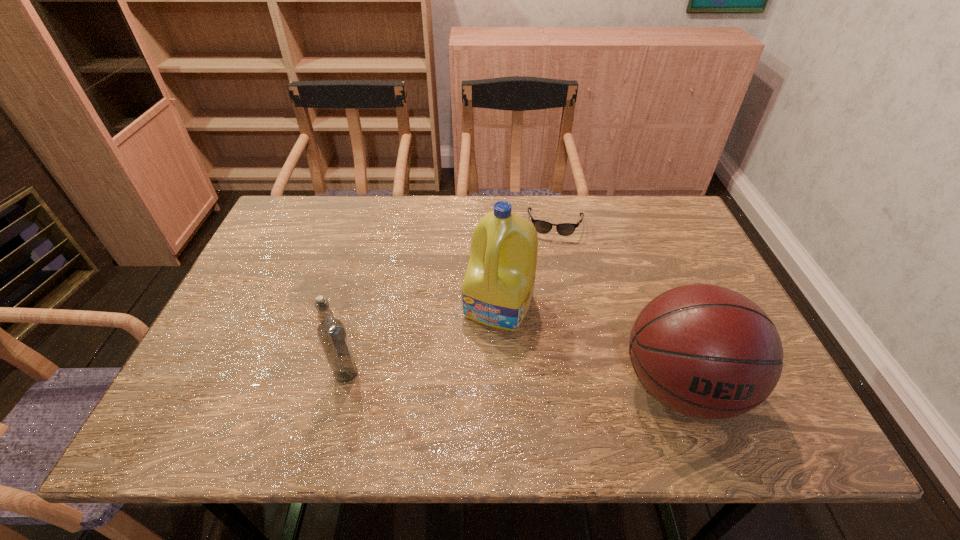
Where is `vacant space on the desktop that is between the leftmost object and the basketball and is positioned on the front-facing side of the farthest object`? Image resolution: width=960 pixels, height=540 pixels. vacant space on the desktop that is between the leftmost object and the basketball and is positioned on the front-facing side of the farthest object is located at coordinates (540, 381).

Where is `vacant space on the desktop that is between the vodka and the basketball and is positioned on the label of the tallest object`? This screenshot has height=540, width=960. vacant space on the desktop that is between the vodka and the basketball and is positioned on the label of the tallest object is located at coordinates (463, 378).